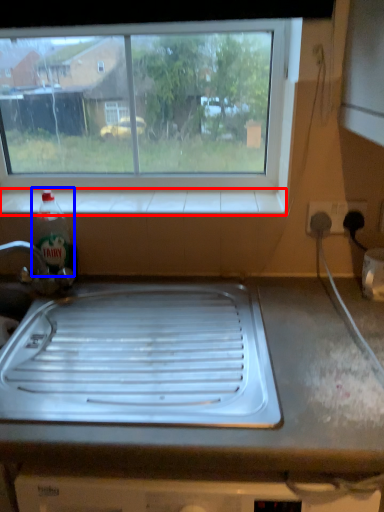
Question: Which object is further to the camera taking this photo, window sill (highlighted by a red box) or bottle (highlighted by a blue box)?

Choices:
 (A) window sill
 (B) bottle

Answer: (A)